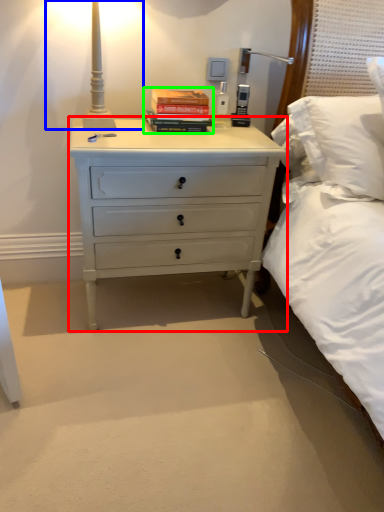
Question: Which object is positioned closest to chest of drawers (highlighted by a red box)? Select from bedside lamp (highlighted by a blue box) and paperback book (highlighted by a green box).

Choices:
 (A) bedside lamp
 (B) paperback book

Answer: (B)